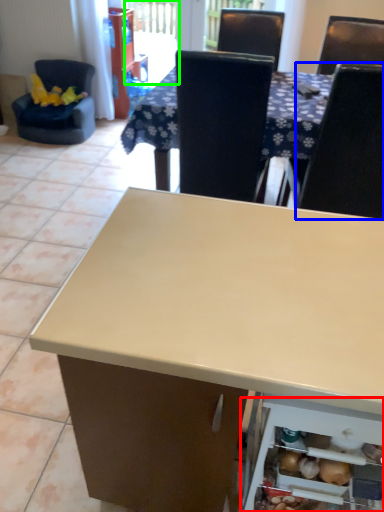
Question: Estimate the real-world distances between objects in this image. Which object is closer to shelf (highlighted by a red box), chair (highlighted by a blue box) or screen door (highlighted by a green box)?

Choices:
 (A) chair
 (B) screen door

Answer: (A)